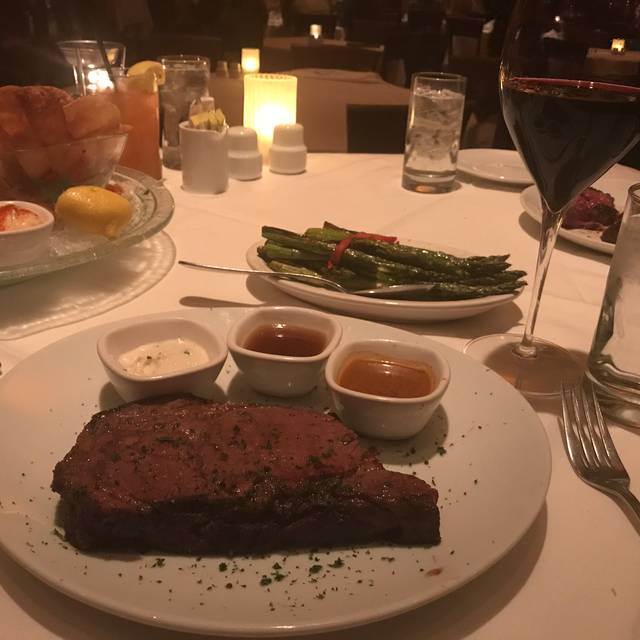
Where is `candle holder`? candle holder is located at coordinates (260, 106).